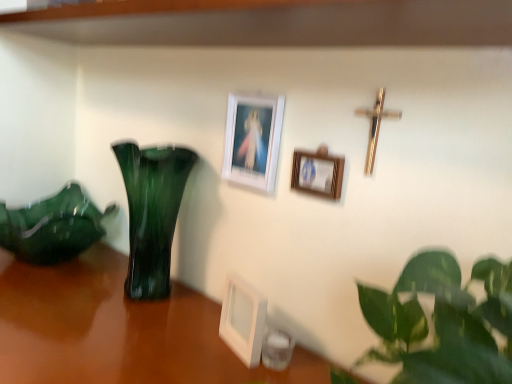
Question: Considering the relative sizes of white matte picture frame at upper center, which appears as the 3th picture frame when ordered from the bottom, and gold metallic crucifix at upper right in the image provided, is white matte picture frame at upper center, which appears as the 3th picture frame when ordered from the bottom, shorter than gold metallic crucifix at upper right?

Choices:
 (A) yes
 (B) no

Answer: (B)

Question: Is white matte picture frame at upper center, arranged as the first picture frame when viewed from the top, positioned beyond the bounds of gold metallic crucifix at upper right?

Choices:
 (A) yes
 (B) no

Answer: (A)

Question: Is white matte picture frame at upper center, arranged as the first picture frame when viewed from the top, oriented towards gold metallic crucifix at upper right?

Choices:
 (A) no
 (B) yes

Answer: (A)

Question: Are white matte picture frame at upper center, which appears as the 3th picture frame when ordered from the bottom, and gold metallic crucifix at upper right far apart?

Choices:
 (A) no
 (B) yes

Answer: (A)

Question: From the image's perspective, does white matte picture frame at upper center, which appears as the 3th picture frame when ordered from the bottom, appear lower than gold metallic crucifix at upper right?

Choices:
 (A) no
 (B) yes

Answer: (A)

Question: Considering the positions of green glass vase at left and white plastic picture frame at center, placed as the third picture frame when sorted from top to bottom, in the image, is green glass vase at left wider or thinner than white plastic picture frame at center, placed as the third picture frame when sorted from top to bottom,?

Choices:
 (A) thin
 (B) wide

Answer: (B)

Question: Considering the relative positions of green glass vase at left and white plastic picture frame at center, the 1th picture frame ordered from the bottom, in the image provided, is green glass vase at left to the left or to the right of white plastic picture frame at center, the 1th picture frame ordered from the bottom,?

Choices:
 (A) left
 (B) right

Answer: (A)

Question: From a real-world perspective, is green glass vase at left physically located above or below white plastic picture frame at center, placed as the third picture frame when sorted from top to bottom?

Choices:
 (A) above
 (B) below

Answer: (A)

Question: Considering the positions of green glass vase at left and white plastic picture frame at center, placed as the third picture frame when sorted from top to bottom, in the image, is green glass vase at left bigger or smaller than white plastic picture frame at center, placed as the third picture frame when sorted from top to bottom,?

Choices:
 (A) big
 (B) small

Answer: (A)

Question: Is green glass vase at left situated inside green glass vase at left or outside?

Choices:
 (A) inside
 (B) outside

Answer: (B)

Question: From the image's perspective, is green glass vase at left located above or below green glass vase at left?

Choices:
 (A) above
 (B) below

Answer: (A)

Question: Based on their sizes in the image, would you say green glass vase at left is bigger or smaller than green glass vase at left?

Choices:
 (A) small
 (B) big

Answer: (A)

Question: Based on their positions, is green glass vase at left located to the left or right of green glass vase at left?

Choices:
 (A) left
 (B) right

Answer: (B)

Question: Is point (278, 97) positioned closer to the camera than point (168, 261)?

Choices:
 (A) closer
 (B) farther

Answer: (A)

Question: Is white matte picture frame at upper center, which appears as the 3th picture frame when ordered from the bottom, situated inside green glass vase at left or outside?

Choices:
 (A) inside
 (B) outside

Answer: (B)